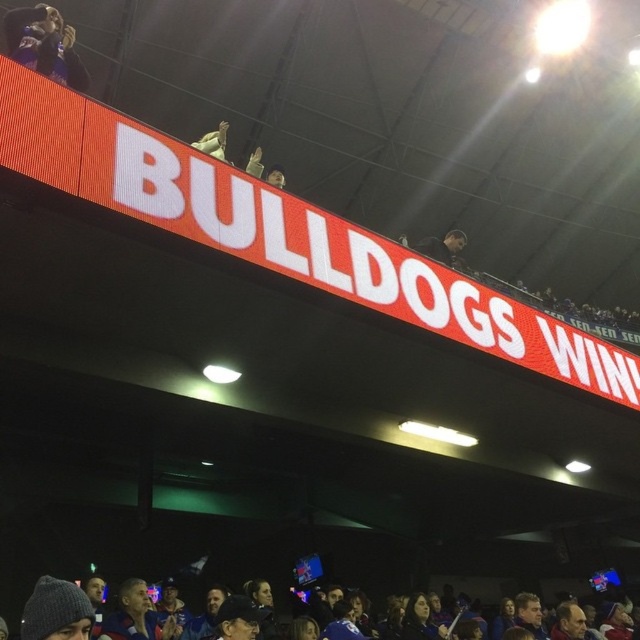
You are standing at the point with coordinates point (19,51) and want to walk towards the point with coordinates point (445,244). Will you have to walk through the area where the scoreboard is displayed?

Point (19,51) is in front of point (445,244), so walking towards it would require passing through the area where the scoreboard is displayed.

You are a photographer trying to capture a photo of the dark fabric hoodie at upper left and the matte white glove at upper center. Which object should you zoom in on to ensure both fit in the frame without cropping?

You should zoom in on the matte white glove at upper center because it is smaller than the dark fabric hoodie at upper left, allowing both to fit within the frame when focusing on the smaller object.

You are a photographer at the stadium and want to capture both the dark fabric hoodie at upper left and the matte white glove at upper center in a single shot. Which object should you focus on first to ensure both are in frame?

The dark fabric hoodie at upper left is taller than the matte white glove at upper center, so you should focus on the dark fabric hoodie at upper left first to ensure both are in frame.